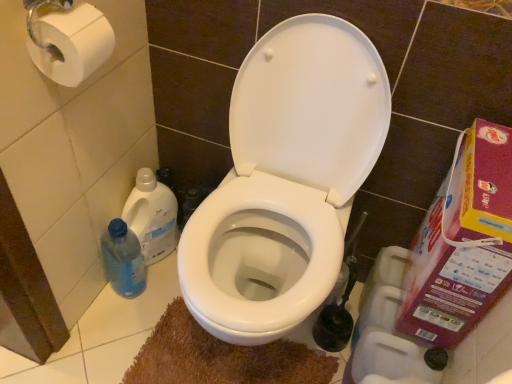
Question: Should I look upward or downward to see white paper at upper left, marked as the second toilet paper in a back-to-front arrangement?

Choices:
 (A) up
 (B) down

Answer: (A)

Question: Is plastic cardboard box at right surrounding blue translucent bottle at left, which ranks as the first cleaning product in bottom-to-top order?

Choices:
 (A) yes
 (B) no

Answer: (B)

Question: Is plastic cardboard box at right aimed at blue translucent bottle at left, which ranks as the first cleaning product in bottom-to-top order?

Choices:
 (A) no
 (B) yes

Answer: (B)

Question: Is plastic cardboard box at right taller than blue translucent bottle at left, the second cleaning product from the top?

Choices:
 (A) no
 (B) yes

Answer: (B)

Question: Is plastic cardboard box at right to the right of blue translucent bottle at left, which ranks as the first cleaning product in bottom-to-top order, from the viewer's perspective?

Choices:
 (A) yes
 (B) no

Answer: (A)

Question: Is plastic cardboard box at right touching blue translucent bottle at left, the second cleaning product from the top?

Choices:
 (A) no
 (B) yes

Answer: (A)

Question: Is plastic cardboard box at right to the left of blue translucent bottle at left, the second cleaning product from the top, from the viewer's perspective?

Choices:
 (A) yes
 (B) no

Answer: (B)

Question: Would you say white matte toilet paper at lower right, the 2th toilet paper viewed from the front, is outside plastic cardboard box at right?

Choices:
 (A) yes
 (B) no

Answer: (A)

Question: Can you confirm if white matte toilet paper at lower right, positioned as the 2th toilet paper in left-to-right order, is wider than plastic cardboard box at right?

Choices:
 (A) no
 (B) yes

Answer: (B)

Question: Is white matte toilet paper at lower right, arranged as the first toilet paper when viewed from the back, surrounding plastic cardboard box at right?

Choices:
 (A) yes
 (B) no

Answer: (B)

Question: Is white matte toilet paper at lower right, the 1th toilet paper in the bottom-to-top sequence, not near plastic cardboard box at right?

Choices:
 (A) no
 (B) yes

Answer: (A)

Question: Considering the relative sizes of white matte toilet paper at lower right, the 2th toilet paper viewed from the top, and plastic cardboard box at right in the image provided, is white matte toilet paper at lower right, the 2th toilet paper viewed from the top, bigger than plastic cardboard box at right?

Choices:
 (A) no
 (B) yes

Answer: (A)

Question: Is white matte toilet paper at lower right, marked as the first toilet paper in a right-to-left arrangement, at the left side of plastic cardboard box at right?

Choices:
 (A) no
 (B) yes

Answer: (B)

Question: Does plastic cardboard box at right have a larger size compared to translucent plastic bottle at lower left, arranged as the 2th cleaning product when ordered from the bottom?

Choices:
 (A) no
 (B) yes

Answer: (B)